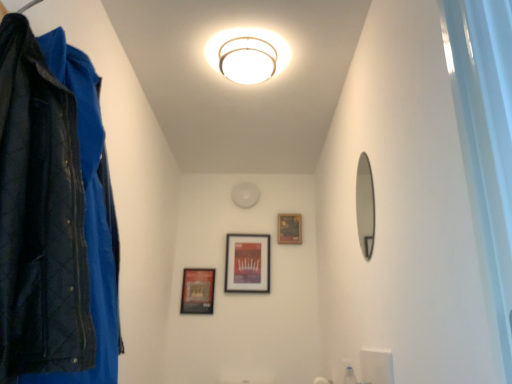
Question: Looking at the image, does transparent plastic bottle at lower right seem bigger or smaller compared to matte black picture frame at center, which is the third picture frame from left to right?

Choices:
 (A) big
 (B) small

Answer: (B)

Question: Is point (351, 380) positioned closer to the camera than point (289, 225)?

Choices:
 (A) farther
 (B) closer

Answer: (B)

Question: Based on their relative distances, which object is farther from the black matte picture frame at center, marked as the 2th picture frame in a right-to-left arrangement?

Choices:
 (A) white glossy light fixture at upper center
 (B) smooth silver mirror at right
 (C) matte black picture frame at center, which ranks as the first picture frame in right-to-left order
 (D) white glossy light at center
 (E) matte black picture frame at lower left, positioned as the third picture frame in right-to-left order

Answer: (A)

Question: Which object is the closest to the matte black picture frame at lower left, which is the 1th picture frame in left-to-right order?

Choices:
 (A) white glossy light fixture at upper center
 (B) transparent plastic bottle at lower right
 (C) smooth silver mirror at right
 (D) black matte picture frame at center, the 2th picture frame from the left
 (E) matte black picture frame at center, which is the third picture frame from left to right

Answer: (D)